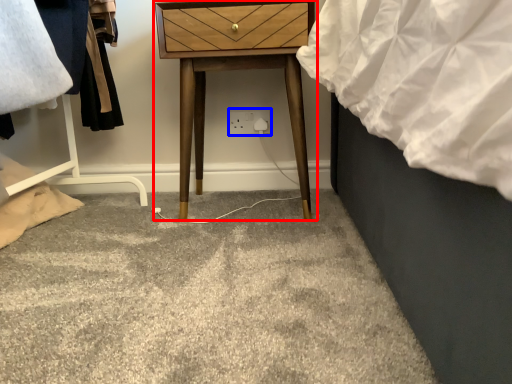
Question: Which of the following is the farthest to the observer, nightstand (highlighted by a red box) or electric outlet (highlighted by a blue box)?

Choices:
 (A) nightstand
 (B) electric outlet

Answer: (B)